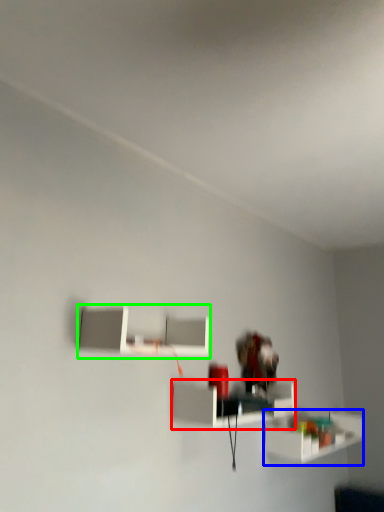
Question: Which is farther away from shelf (highlighted by a red box)? shelf (highlighted by a blue box) or shelf (highlighted by a green box)?

Choices:
 (A) shelf
 (B) shelf

Answer: (A)